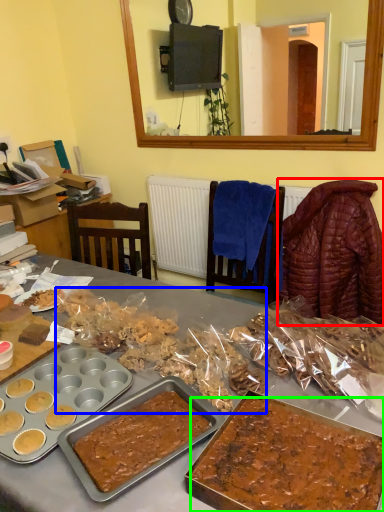
Question: Estimate the real-world distances between objects in this image. Which object is closer to blanket (highlighted by a red box), snack (highlighted by a blue box) or dessert (highlighted by a green box)?

Choices:
 (A) snack
 (B) dessert

Answer: (A)